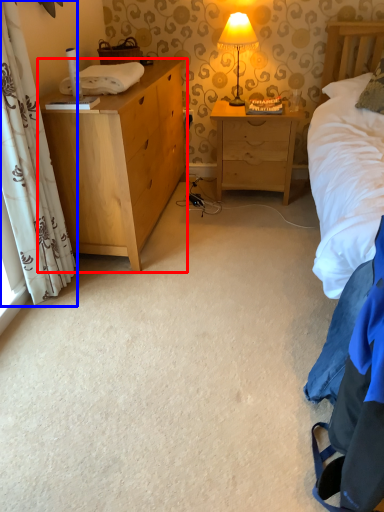
Question: Which object appears closest to the camera in this image, chest of drawers (highlighted by a red box) or curtain (highlighted by a blue box)?

Choices:
 (A) chest of drawers
 (B) curtain

Answer: (B)